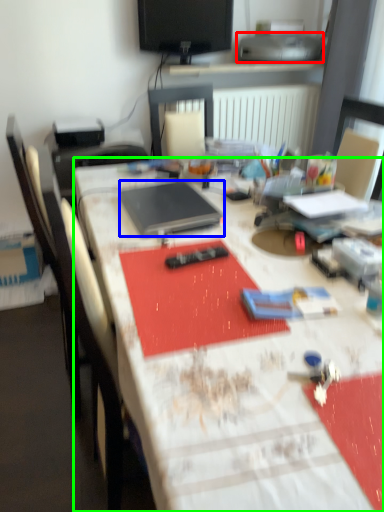
Question: Based on their relative distances, which object is nearer to printer (highlighted by a red box)? Choose from laptop (highlighted by a blue box) and desk (highlighted by a green box).

Choices:
 (A) laptop
 (B) desk

Answer: (A)